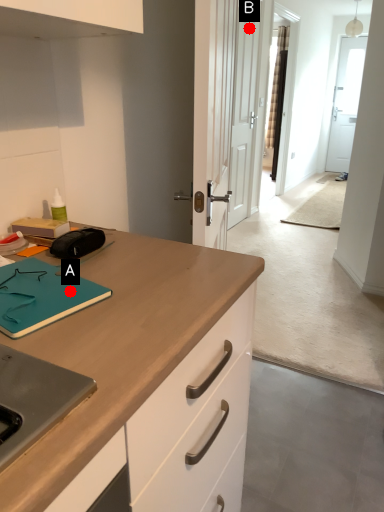
Question: Two points are circled on the image, labeled by A and B beside each circle. Which point appears farthest from the camera in this image?

Choices:
 (A) A is further
 (B) B is further

Answer: (B)